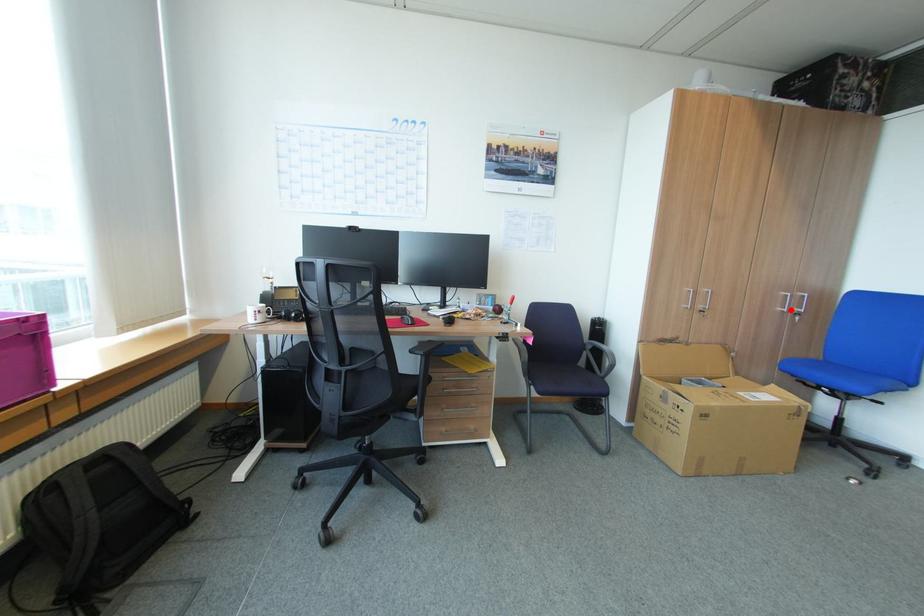
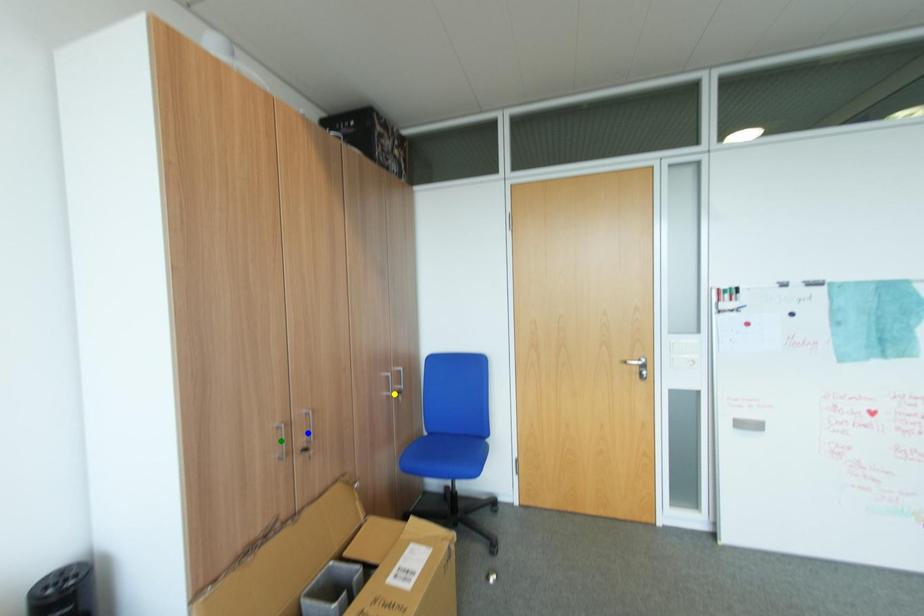
Question: I am providing you with two images of the same scene from different viewpoints. A red point is marked on the first image. You are given multiple points on the second image. In image 2, which mark is for the same physical point as the one in image 1?

Choices:
 (A) green point
 (B) yellow point
 (C) blue point

Answer: (B)